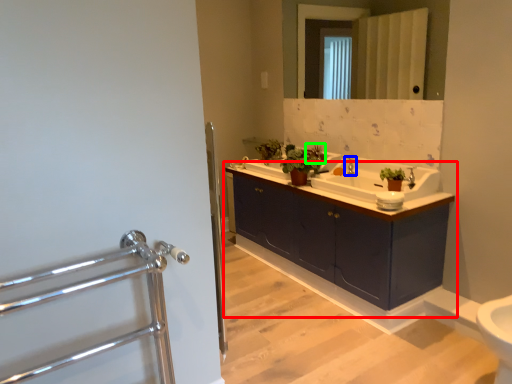
Question: Based on their relative distances, which object is farther from bathroom cabinet (highlighted by a red box)? Choose from tap (highlighted by a blue box) and plant (highlighted by a green box).

Choices:
 (A) tap
 (B) plant

Answer: (B)